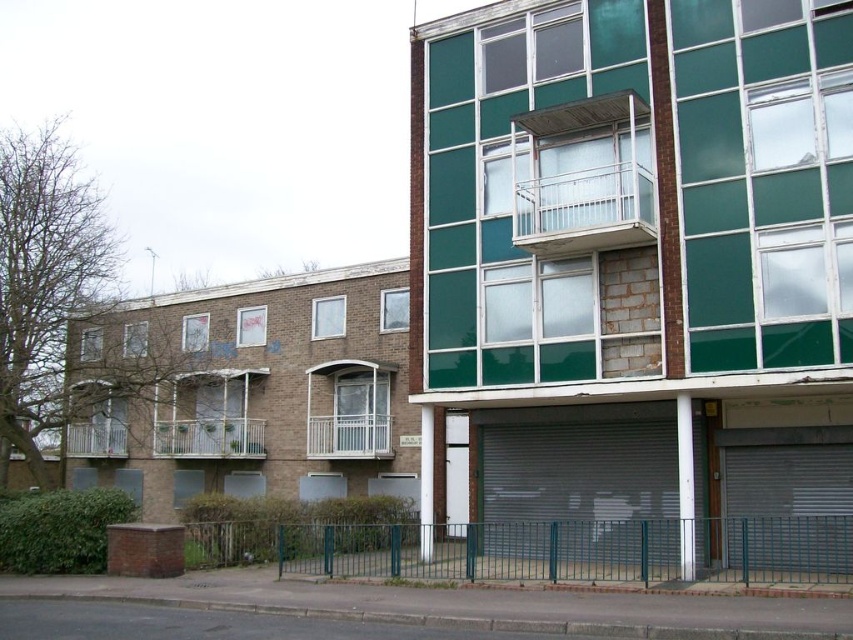
Based on the photo, which is below, green metal fence at lower center or white metal balcony at lower left?

Positioned lower is green metal fence at lower center.

Is green metal fence at lower center shorter than white metal balcony at lower left?

Incorrect, green metal fence at lower center's height does not fall short of white metal balcony at lower left's.

Who is more distant from viewer, (x=577, y=534) or (x=196, y=444)?

Positioned behind is point (x=196, y=444).

The width and height of the screenshot is (853, 640). Find the location of `green metal fence at lower center`. green metal fence at lower center is located at coordinates (578, 548).

Can you confirm if white metal balcony at upper center is positioned above white wooden balcony at center?

Yes.

Between point (619, 166) and point (227, 401), which one is positioned behind?

The point (227, 401) is behind.

Which is behind, point (579, 115) or point (256, 454)?

Point (256, 454)

At what (x,y) coordinates should I click in order to perform the action: click on white metal balcony at upper center. Please return your answer as a coordinate pair (x, y). Looking at the image, I should click on (584, 177).

Between white wooden balcony at center and white textured balcony at center, which one appears on the right side from the viewer's perspective?

white textured balcony at center is more to the right.

Can you confirm if white wooden balcony at center is thinner than white textured balcony at center?

Incorrect, white wooden balcony at center's width is not less than white textured balcony at center's.

Is point (177, 380) behind point (364, 451)?

That is True.

This screenshot has height=640, width=853. Identify the location of white wooden balcony at center. (212, 417).